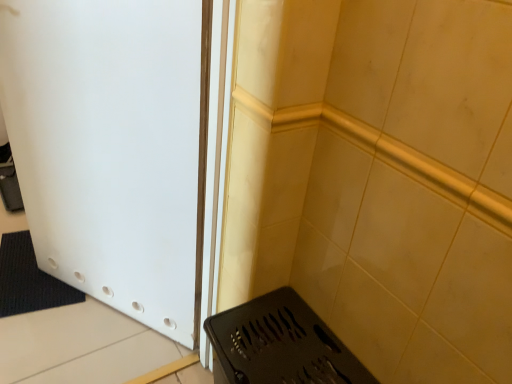
Question: Is white matte door at left facing away from black matte grill at lower right?

Choices:
 (A) no
 (B) yes

Answer: (A)

Question: From a real-world perspective, is white matte door at left beneath black matte grill at lower right?

Choices:
 (A) no
 (B) yes

Answer: (A)

Question: Does white matte door at left touch black matte grill at lower right?

Choices:
 (A) no
 (B) yes

Answer: (A)

Question: Is the depth of white matte door at left less than that of black matte grill at lower right?

Choices:
 (A) yes
 (B) no

Answer: (A)

Question: Is white matte door at left further to the viewer compared to black matte grill at lower right?

Choices:
 (A) yes
 (B) no

Answer: (B)

Question: Can you confirm if white matte door at left is thinner than black matte grill at lower right?

Choices:
 (A) no
 (B) yes

Answer: (B)

Question: Is black matte grill at lower right thinner than white matte door at left?

Choices:
 (A) no
 (B) yes

Answer: (A)

Question: Is black matte grill at lower right taller than white matte door at left?

Choices:
 (A) yes
 (B) no

Answer: (B)

Question: Is black matte grill at lower right to the right of white matte door at left from the viewer's perspective?

Choices:
 (A) no
 (B) yes

Answer: (B)

Question: Is the depth of black matte grill at lower right less than that of white matte door at left?

Choices:
 (A) no
 (B) yes

Answer: (A)

Question: Is there a large distance between black matte grill at lower right and white matte door at left?

Choices:
 (A) no
 (B) yes

Answer: (A)

Question: Is black matte grill at lower right surrounding white matte door at left?

Choices:
 (A) yes
 (B) no

Answer: (B)

Question: In terms of width, does black matte grill at lower right look wider or thinner when compared to white matte door at left?

Choices:
 (A) wide
 (B) thin

Answer: (A)